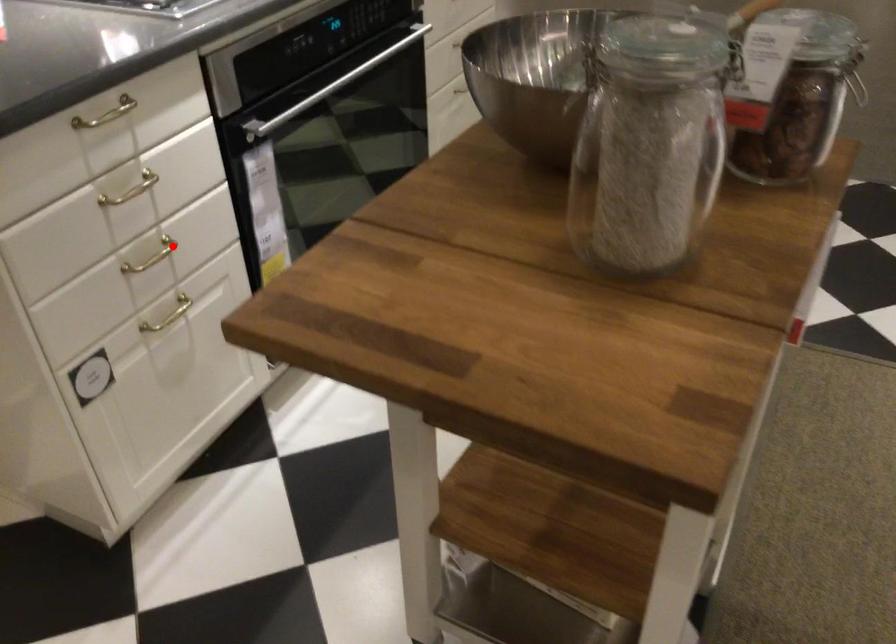
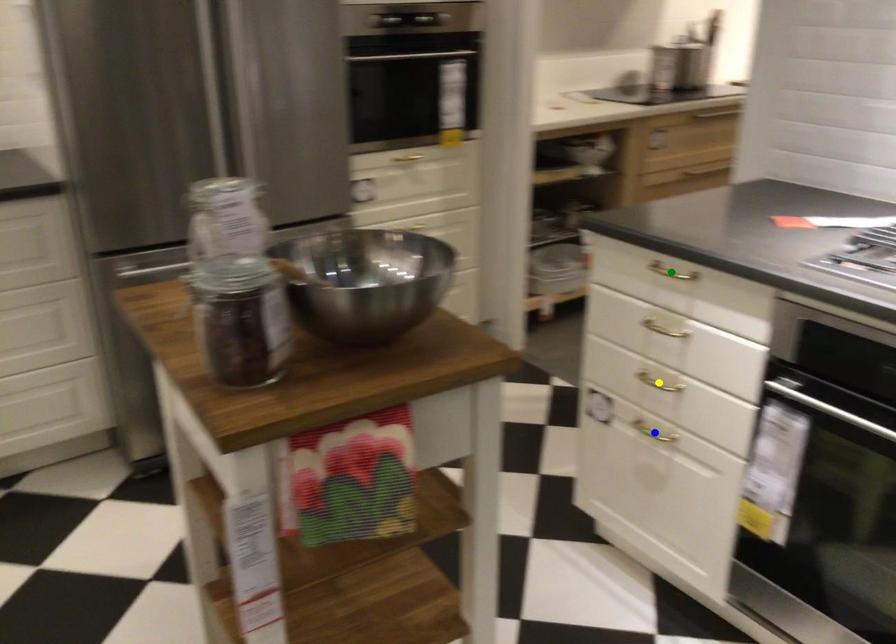
Question: I am providing you with two images of the same scene from different viewpoints. A red point is marked on the first image. You are given multiple points on the second image. Which point in image 2 represents the same 3d spot as the red point in image 1?

Choices:
 (A) green point
 (B) blue point
 (C) yellow point

Answer: (C)